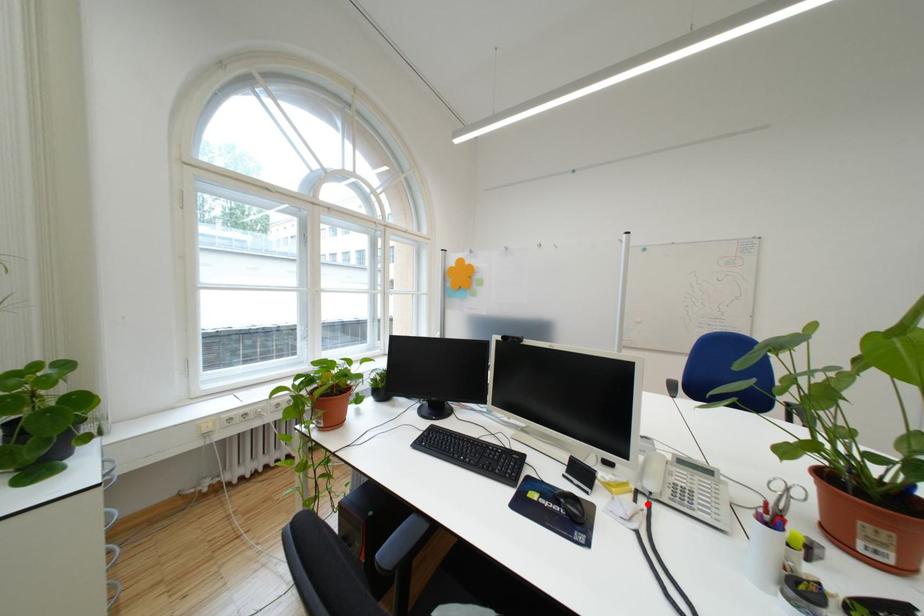
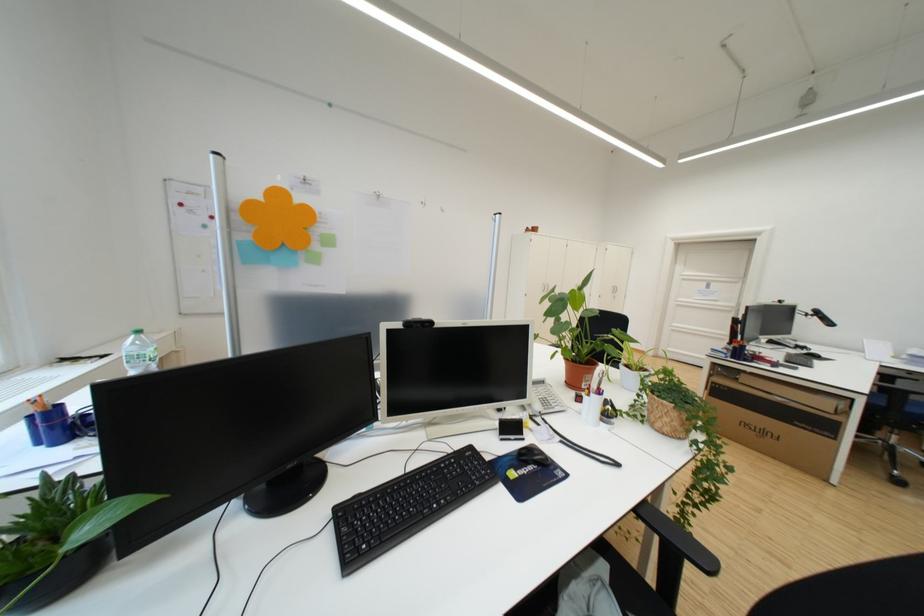
In the second image, find the point that corresponds to the highlighted location in the first image.

(551, 426)